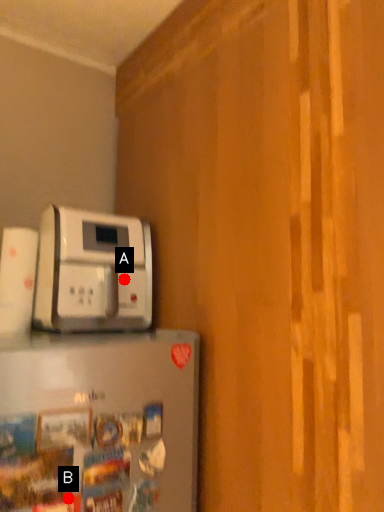
Question: Two points are circled on the image, labeled by A and B beside each circle. Which point is farther from the camera taking this photo?

Choices:
 (A) A is further
 (B) B is further

Answer: (A)